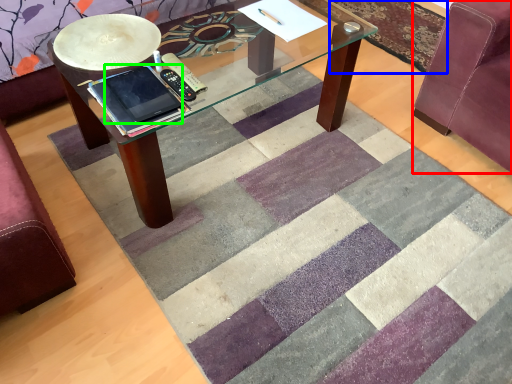
Question: Estimate the real-world distances between objects in this image. Which object is closer to swivel chair (highlighted by a red box), mat (highlighted by a blue box) or ipad (highlighted by a green box)?

Choices:
 (A) mat
 (B) ipad

Answer: (A)